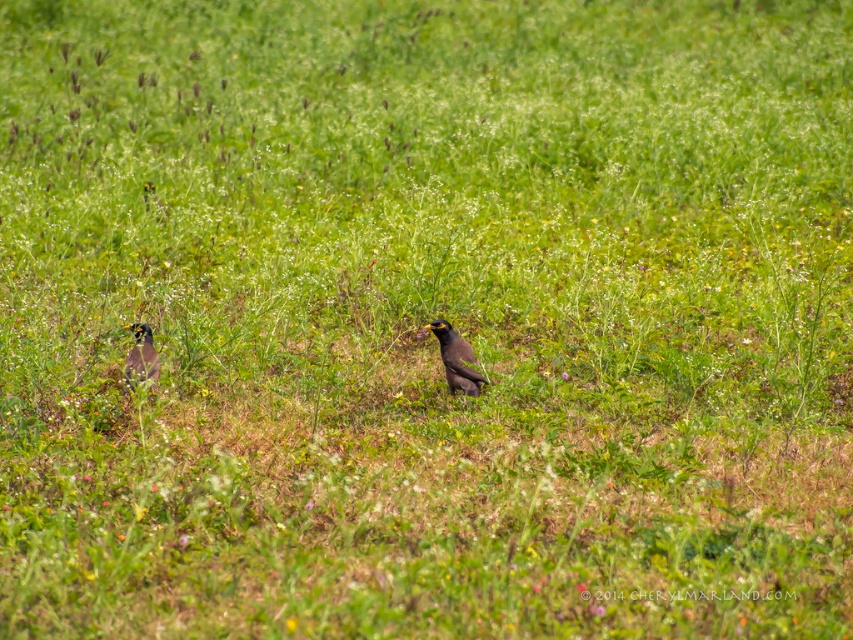
You are a birdwatcher trying to identify two birds in a field. You see a brown speckled bird at center and a shiny black bird at left. Which bird is larger?

A: The brown speckled bird at center is bigger than the shiny black bird at left.